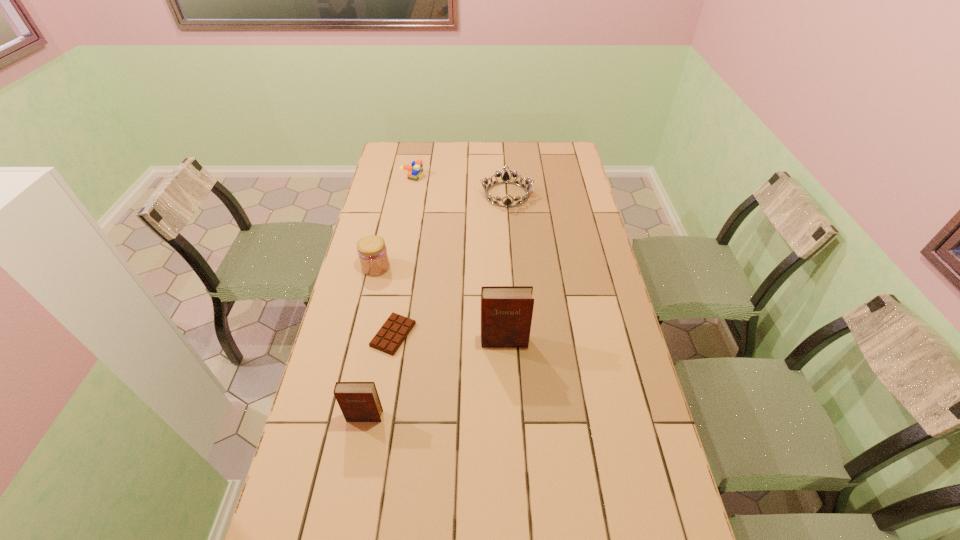
Locate an element on the screen. The height and width of the screenshot is (540, 960). the nearer diary is located at coordinates (359, 401).

Identify the location of the left diary. Image resolution: width=960 pixels, height=540 pixels. (359, 401).

The height and width of the screenshot is (540, 960). Find the location of `the taller diary`. the taller diary is located at coordinates tap(506, 311).

Where is `the tallest object`? Image resolution: width=960 pixels, height=540 pixels. the tallest object is located at coordinates (506, 311).

The height and width of the screenshot is (540, 960). Identify the location of Lego. (414, 171).

You are a GUI agent. You are given a task and a screenshot of the screen. Output one action in this format:
    pyautogui.click(x=<x>, y=<y>)
    Task: Click on the tiara
    
    Given the screenshot: What is the action you would take?
    pyautogui.click(x=506, y=178)

Identify the location of the third farthest object. (372, 252).

Find the location of a particular element. The width and height of the screenshot is (960, 540). the fourth shortest object is located at coordinates (372, 252).

The width and height of the screenshot is (960, 540). Find the location of `candy bar`. candy bar is located at coordinates (391, 335).

The width and height of the screenshot is (960, 540). I want to click on blank space located 0.070m on the front cover of the second tallest object, so click(x=358, y=448).